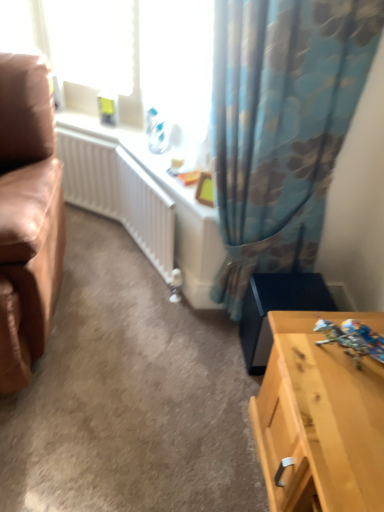
Question: Does leather at left have a greater height compared to floral fabric curtain at upper right?

Choices:
 (A) yes
 (B) no

Answer: (B)

Question: From the image's perspective, does leather at left appear lower than floral fabric curtain at upper right?

Choices:
 (A) yes
 (B) no

Answer: (A)

Question: Can you confirm if leather at left is thinner than floral fabric curtain at upper right?

Choices:
 (A) yes
 (B) no

Answer: (B)

Question: Does leather at left have a lesser height compared to floral fabric curtain at upper right?

Choices:
 (A) yes
 (B) no

Answer: (A)

Question: Does leather at left come behind floral fabric curtain at upper right?

Choices:
 (A) no
 (B) yes

Answer: (A)

Question: Is floral fabric curtain at upper right bigger or smaller than white plastic window screen at upper left?

Choices:
 (A) small
 (B) big

Answer: (B)

Question: From a real-world perspective, is floral fabric curtain at upper right physically located above or below white plastic window screen at upper left?

Choices:
 (A) above
 (B) below

Answer: (B)

Question: Is floral fabric curtain at upper right in front of or behind white plastic window screen at upper left in the image?

Choices:
 (A) front
 (B) behind

Answer: (A)

Question: Considering the positions of floral fabric curtain at upper right and white plastic window screen at upper left in the image, is floral fabric curtain at upper right wider or thinner than white plastic window screen at upper left?

Choices:
 (A) wide
 (B) thin

Answer: (A)

Question: Would you say leather at left is inside or outside floral fabric curtain at upper right?

Choices:
 (A) outside
 (B) inside

Answer: (A)

Question: From a real-world perspective, relative to floral fabric curtain at upper right, is leather at left vertically above or below?

Choices:
 (A) above
 (B) below

Answer: (B)

Question: Considering their positions, is leather at left located in front of or behind floral fabric curtain at upper right?

Choices:
 (A) front
 (B) behind

Answer: (A)

Question: Is leather at left bigger or smaller than floral fabric curtain at upper right?

Choices:
 (A) big
 (B) small

Answer: (A)

Question: In terms of width, does shiny metallic robot at lower right look wider or thinner when compared to leather at left?

Choices:
 (A) wide
 (B) thin

Answer: (B)

Question: From their relative heights in the image, would you say shiny metallic robot at lower right is taller or shorter than leather at left?

Choices:
 (A) tall
 (B) short

Answer: (B)